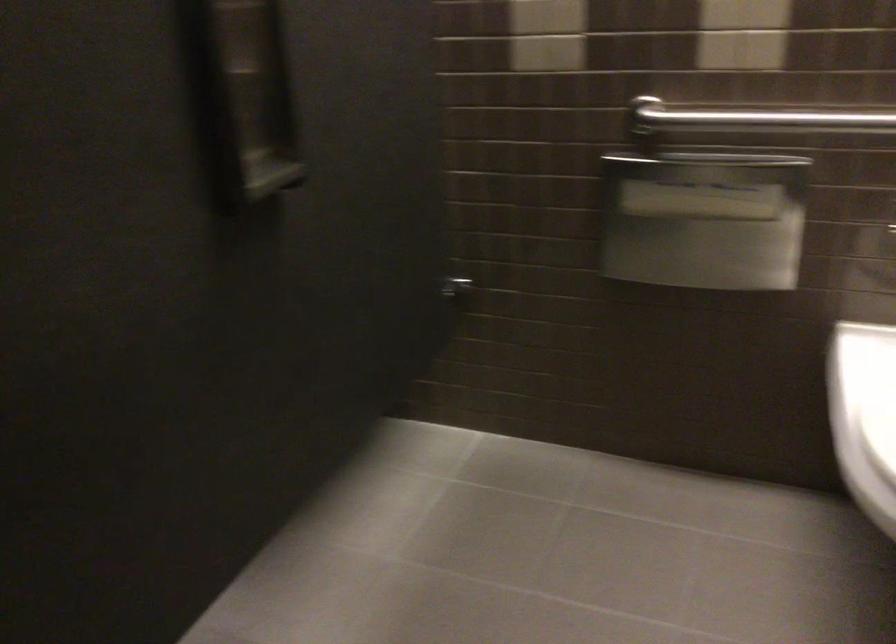
You are a GUI agent. You are given a task and a screenshot of the screen. Output one action in this format:
    pyautogui.click(x=<x>, y=<y>)
    Task: Click on the metal grab bar
    
    Given the screenshot: What is the action you would take?
    pyautogui.click(x=751, y=116)